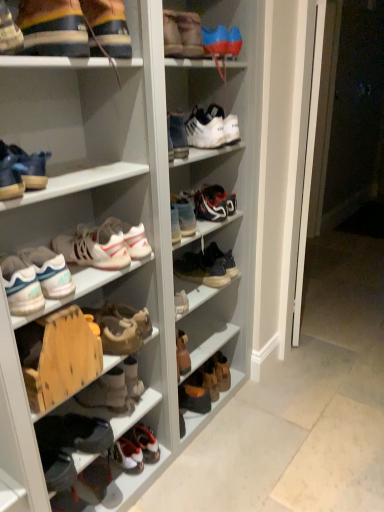
Question: Could you tell me if white matte sneakers at center, which is the eighth footwear in bottom-to-top order, is facing white matte sneaker at center, which ranks as the 12th footwear in bottom-to-top order?

Choices:
 (A) no
 (B) yes

Answer: (A)

Question: Would you say white matte sneakers at center, which is the eighth footwear in bottom-to-top order, contains white matte sneaker at center, which ranks as the 12th footwear in bottom-to-top order?

Choices:
 (A) yes
 (B) no

Answer: (B)

Question: Is the depth of white matte sneakers at center, which is the eighth footwear in bottom-to-top order, less than that of white matte sneaker at center, which ranks as the 12th footwear in bottom-to-top order?

Choices:
 (A) yes
 (B) no

Answer: (A)

Question: Is white matte sneakers at center, which is the eighth footwear in bottom-to-top order, smaller than white matte sneaker at center, which ranks as the 12th footwear in bottom-to-top order?

Choices:
 (A) yes
 (B) no

Answer: (A)

Question: Is white matte sneakers at center, which is the eighth footwear in bottom-to-top order, to the right of white matte sneaker at center, which ranks as the 12th footwear in bottom-to-top order, from the viewer's perspective?

Choices:
 (A) yes
 (B) no

Answer: (B)

Question: Considering the positions of matte blue shoe at left, the sixth footwear from the top, and shiny blue sneakers at center, acting as the tenth footwear starting from the bottom, in the image, is matte blue shoe at left, the sixth footwear from the top, wider or thinner than shiny blue sneakers at center, acting as the tenth footwear starting from the bottom,?

Choices:
 (A) thin
 (B) wide

Answer: (A)

Question: From the image's perspective, relative to shiny blue sneakers at center, marked as the fifth footwear in a top-to-bottom arrangement, is matte blue shoe at left, the sixth footwear from the top, above or below?

Choices:
 (A) above
 (B) below

Answer: (B)

Question: Considering the relative positions of matte blue shoe at left, placed as the ninth footwear when sorted from bottom to top, and shiny blue sneakers at center, acting as the tenth footwear starting from the bottom, in the image provided, is matte blue shoe at left, placed as the ninth footwear when sorted from bottom to top, to the left or to the right of shiny blue sneakers at center, acting as the tenth footwear starting from the bottom,?

Choices:
 (A) right
 (B) left

Answer: (B)

Question: In the image, is matte blue shoe at left, placed as the ninth footwear when sorted from bottom to top, positioned in front of or behind shiny blue sneakers at center, acting as the tenth footwear starting from the bottom?

Choices:
 (A) behind
 (B) front

Answer: (B)

Question: Does point (144, 257) appear closer or farther from the camera than point (34, 273)?

Choices:
 (A) farther
 (B) closer

Answer: (A)

Question: In terms of size, does white matte sneakers at center, which is the eighth footwear in bottom-to-top order, appear bigger or smaller than white matte sneakers at left, acting as the 11th footwear starting from the top?

Choices:
 (A) big
 (B) small

Answer: (B)

Question: Considering the positions of white matte sneakers at center, the 7th footwear in the top-to-bottom sequence, and white matte sneakers at left, positioned as the fourth footwear in bottom-to-top order, in the image, is white matte sneakers at center, the 7th footwear in the top-to-bottom sequence, wider or thinner than white matte sneakers at left, positioned as the fourth footwear in bottom-to-top order,?

Choices:
 (A) thin
 (B) wide

Answer: (A)

Question: From the image's perspective, is white matte sneakers at center, which is the eighth footwear in bottom-to-top order, positioned above or below white matte sneakers at left, acting as the 11th footwear starting from the top?

Choices:
 (A) above
 (B) below

Answer: (A)

Question: Is white matte sneaker at upper center, the 2th footwear viewed from the top, to the left or to the right of shiny blue sneakers at center, marked as the fifth footwear in a top-to-bottom arrangement, in the image?

Choices:
 (A) left
 (B) right

Answer: (B)

Question: From a real-world perspective, is white matte sneaker at upper center, the 2th footwear viewed from the top, positioned above or below shiny blue sneakers at center, marked as the fifth footwear in a top-to-bottom arrangement?

Choices:
 (A) above
 (B) below

Answer: (A)